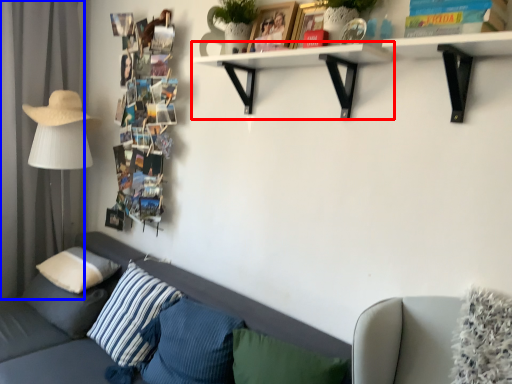
Question: Which object is closer to the camera taking this photo, shelf (highlighted by a red box) or curtain (highlighted by a blue box)?

Choices:
 (A) shelf
 (B) curtain

Answer: (A)